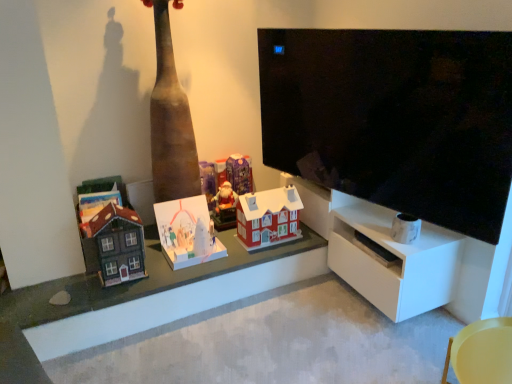
Image resolution: width=512 pixels, height=384 pixels. Identify the location of free space on the front side of matte brown wooden house at left, the first toy viewed from the left. (110, 293).